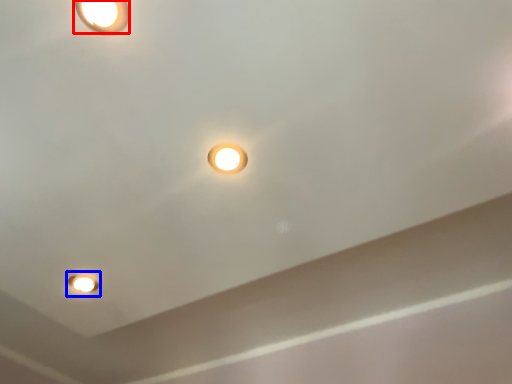
Question: Which of the following is the closest to the observer, lamp (highlighted by a red box) or light fixture (highlighted by a blue box)?

Choices:
 (A) lamp
 (B) light fixture

Answer: (A)